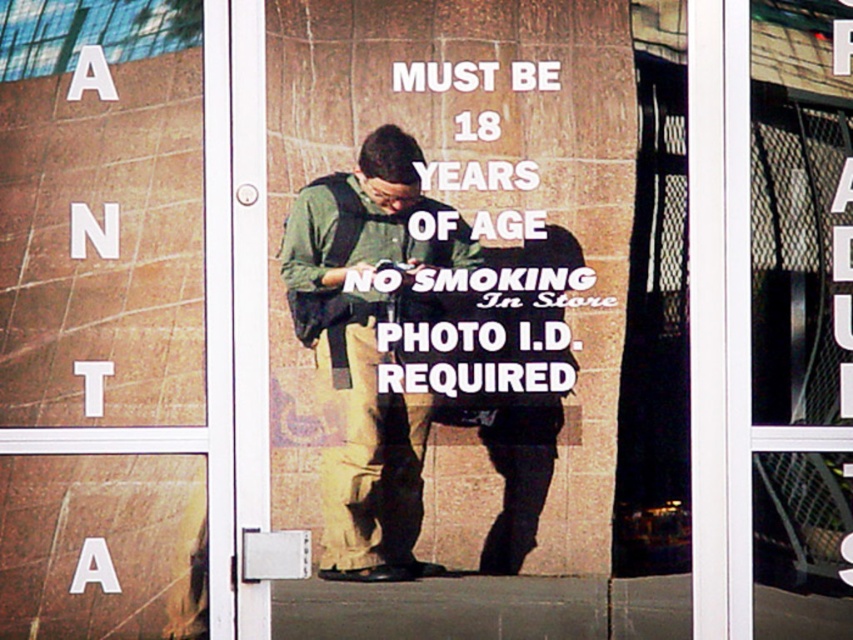
You are a delivery person who needs to place a new backpack on the floor near the green fabric backpack at center. The matte brown sign at upper left is in the way. Can you move the sign to make space?

The matte brown sign at upper left is taller than the green fabric backpack at center, so moving it might require lifting it above the backpack. However, since the sign is likely fixed in place, you cannot move it to create space.

You are a delivery person who needs to secure a package on your back. You see the matte brown sign at upper left and the green fabric backpack at center. Which item is located to the left of the other?

The matte brown sign at upper left is positioned on the left side of green fabric backpack at center.

You are a delivery person who needs to hand over a package to the person inside the store. The package is too large to fit through the door. You see the matte brown sign at upper left and the green fabric backpack at center. Which object is closer to you?

The matte brown sign at upper left is closer to the viewer than the green fabric backpack at center.